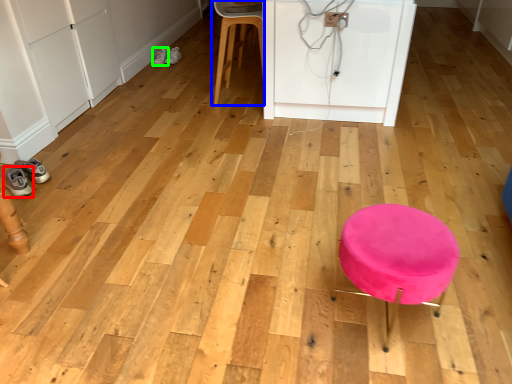
Question: Considering the real-world distances, which object is farthest from footwear (highlighted by a red box)? chair (highlighted by a blue box) or footwear (highlighted by a green box)?

Choices:
 (A) chair
 (B) footwear

Answer: (B)